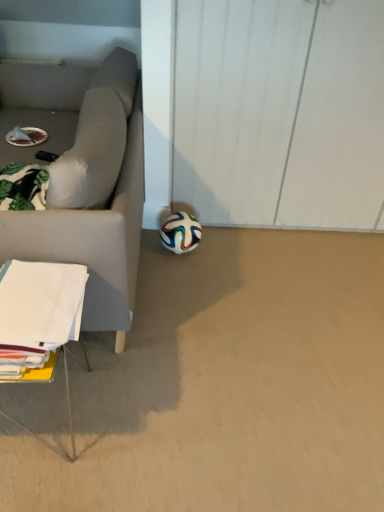
Question: From the image's perspective, is multicolored rubber football at lower center above or below white paper at lower left?

Choices:
 (A) below
 (B) above

Answer: (B)

Question: From a real-world perspective, relative to white paper at lower left, is multicolored rubber football at lower center vertically above or below?

Choices:
 (A) above
 (B) below

Answer: (B)

Question: Considering the positions of point (185, 223) and point (46, 310), is point (185, 223) closer or farther from the camera than point (46, 310)?

Choices:
 (A) farther
 (B) closer

Answer: (A)

Question: From a real-world perspective, is white paper at lower left physically located above or below multicolored rubber football at lower center?

Choices:
 (A) below
 (B) above

Answer: (B)

Question: In terms of height, does white paper at lower left look taller or shorter compared to multicolored rubber football at lower center?

Choices:
 (A) short
 (B) tall

Answer: (B)

Question: Is white paper at lower left wider or thinner than multicolored rubber football at lower center?

Choices:
 (A) wide
 (B) thin

Answer: (A)

Question: Is white paper at lower left inside the boundaries of multicolored rubber football at lower center, or outside?

Choices:
 (A) outside
 (B) inside

Answer: (A)